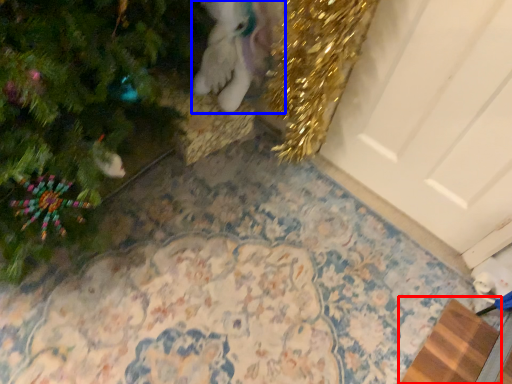
Question: Which point is closer to the camera, doormat (highlighted by a red box) or animal (highlighted by a blue box)?

Choices:
 (A) doormat
 (B) animal

Answer: (B)